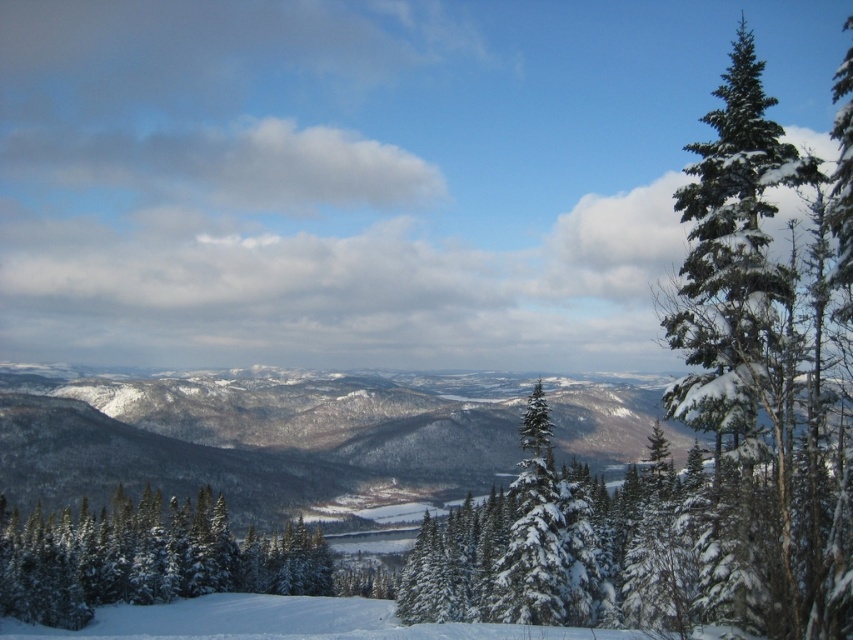
You are standing at the bottom of the ski slope in the foreground and want to reach the point marked as point [735,273]. Based on the scene description, which direction should you head towards to reach it?

You should head towards the right side of the scene since point [735,273] is located on the green snow covered evergreen at right.